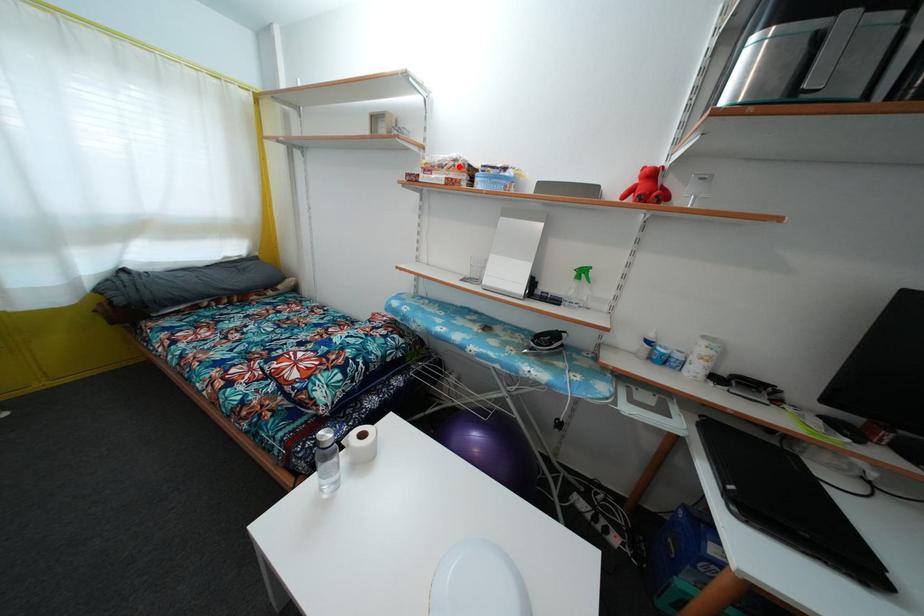
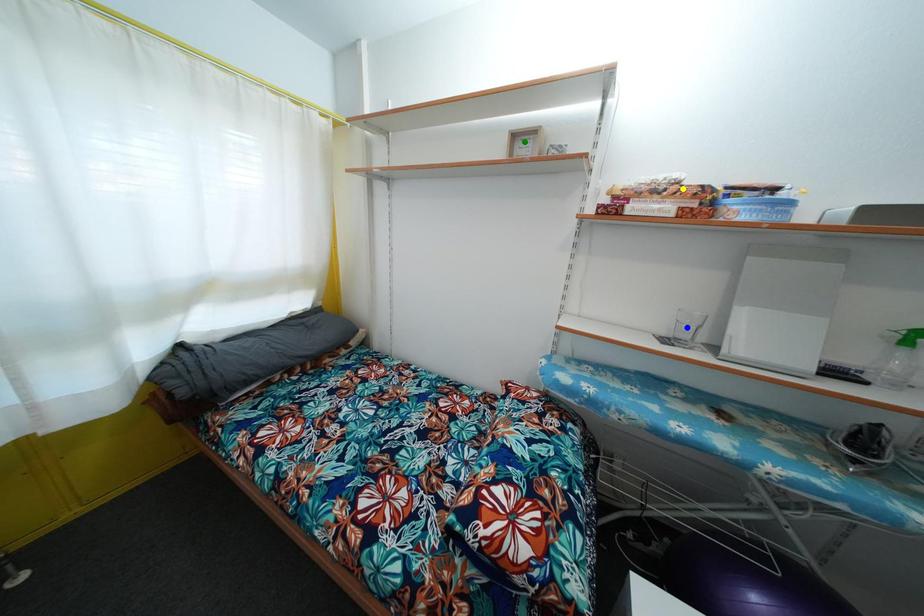
Question: I am providing you with two images of the same scene from different viewpoints. A red point is marked on the first image. You are given multiple points on the second image. In image 2, which mark is for the same physical point as the one in image 1?

Choices:
 (A) yellow point
 (B) green point
 (C) blue point

Answer: (A)